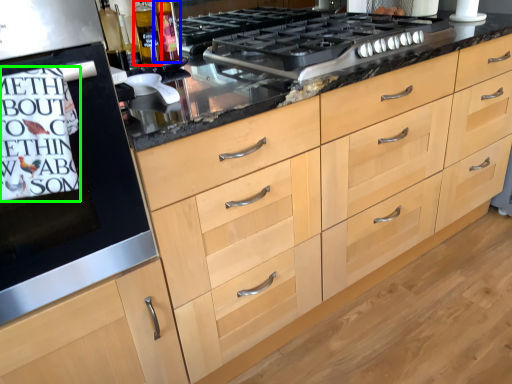
Question: Which is farther away from bottle (highlighted by a red box)? bottle (highlighted by a blue box) or writing (highlighted by a green box)?

Choices:
 (A) bottle
 (B) writing

Answer: (B)